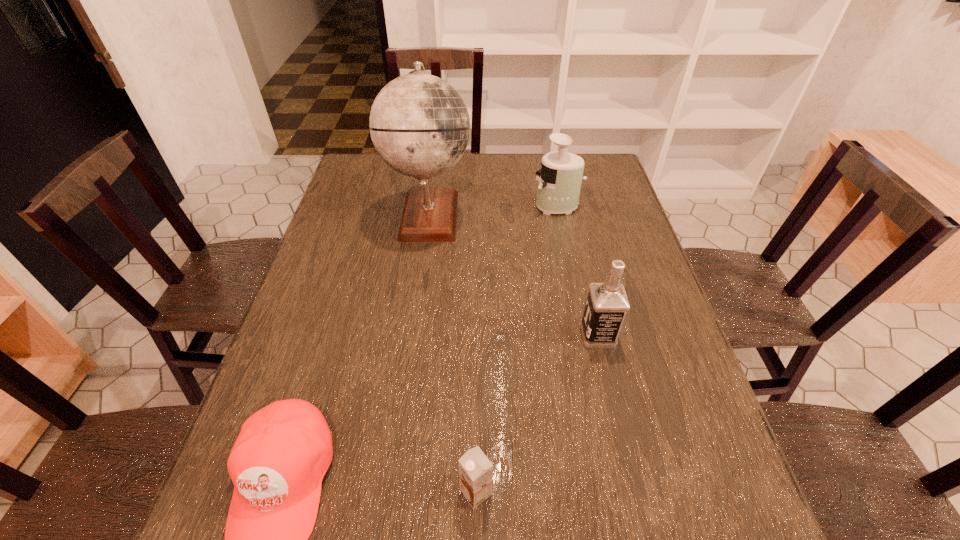
The image size is (960, 540). Find the location of `vacant region between the juicer and the vodka`. vacant region between the juicer and the vodka is located at coordinates (577, 271).

The width and height of the screenshot is (960, 540). I want to click on free space that is in between the tallest object and the juicer, so click(493, 210).

At what (x,y) coordinates should I click in order to perform the action: click on free space between the juicer and the chocolate milk. Please return your answer as a coordinate pair (x, y). The height and width of the screenshot is (540, 960). Looking at the image, I should click on (516, 349).

Locate an element on the screen. empty space between the juicer and the globe is located at coordinates (493, 210).

Where is `vacant area that lies between the vodka and the globe`? vacant area that lies between the vodka and the globe is located at coordinates (514, 275).

Locate an element on the screen. Image resolution: width=960 pixels, height=540 pixels. object that is the second closest to the chocolate milk is located at coordinates (607, 303).

Locate an element on the screen. object that stands as the third closest to the vodka is located at coordinates (560, 180).

The height and width of the screenshot is (540, 960). I want to click on vacant space that satisfies the following two spatial constraints: 1. on the front side of the juicer; 2. at the equator of the tallest object, so click(559, 214).

I want to click on free space that satisfies the following two spatial constraints: 1. on the back side of the chocolate milk; 2. at the equator of the tallest object, so click(478, 214).